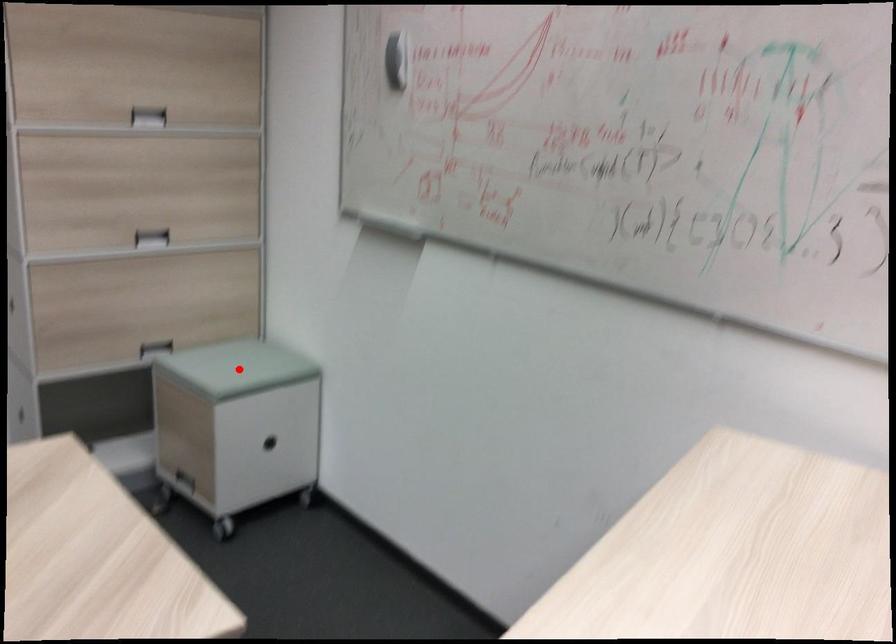
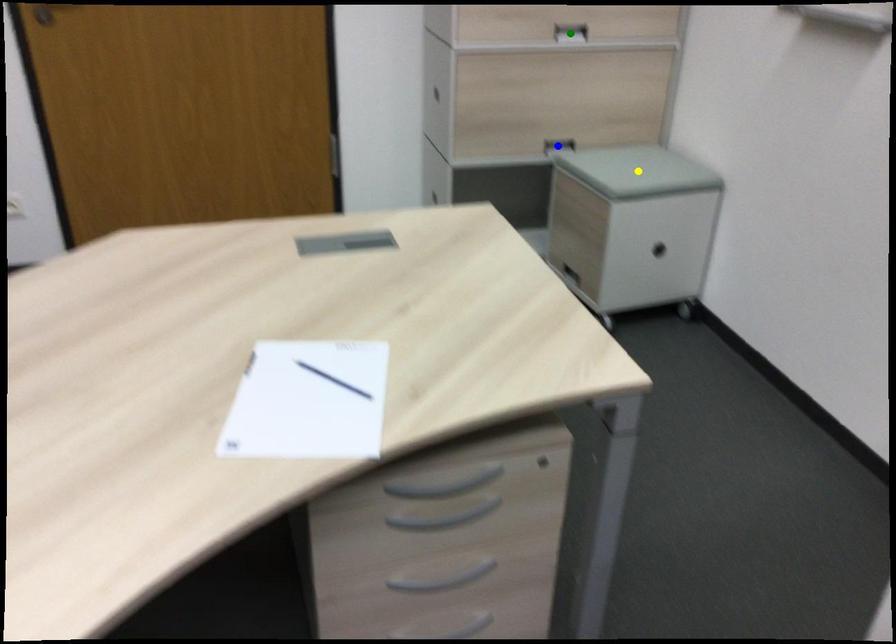
Question: I am providing you with two images of the same scene from different viewpoints. A red point is marked on the first image. You are given multiple points on the second image. Which spot in image 2 lines up with the point in image 1?

Choices:
 (A) yellow point
 (B) green point
 (C) blue point

Answer: (A)